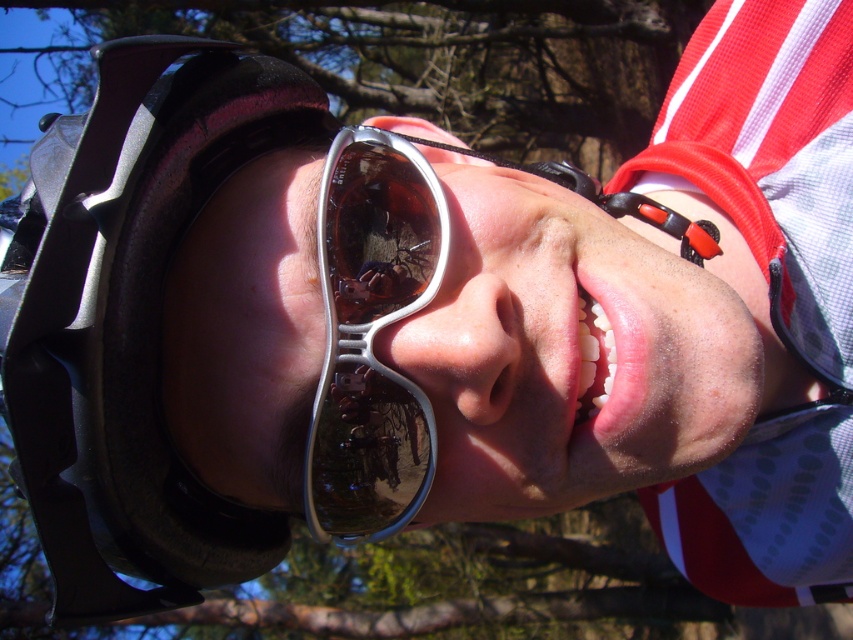
You are a photographer setting up for a portrait. You need to ensure that the black matte helmet at left and the silver metallic sunglasses at center do not overlap in the final shot. Based on their sizes, can you position the camera so that both objects remain visible without overlapping?

The black matte helmet at left might be wider than silver metallic sunglasses at center, so positioning the camera to avoid overlap would depend on their actual widths. Since the helmet could be wider, ensure there is enough space between them in the frame to prevent overlapping.

You are a photographer adjusting your camera settings to capture the scene. You notice the black matte helmet at left and the silver metallic sunglasses at center. Which object is positioned higher in the frame?

The black matte helmet at left is above the silver metallic sunglasses at center, so it is positioned higher in the frame.